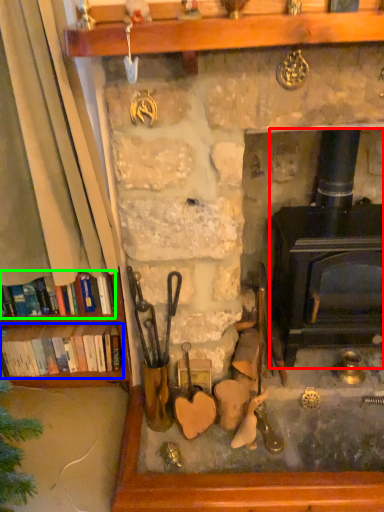
Question: Estimate the real-world distances between objects in this image. Which object is farther from wood burning stove (highlighted by a red box), book (highlighted by a blue box) or book (highlighted by a green box)?

Choices:
 (A) book
 (B) book

Answer: (A)